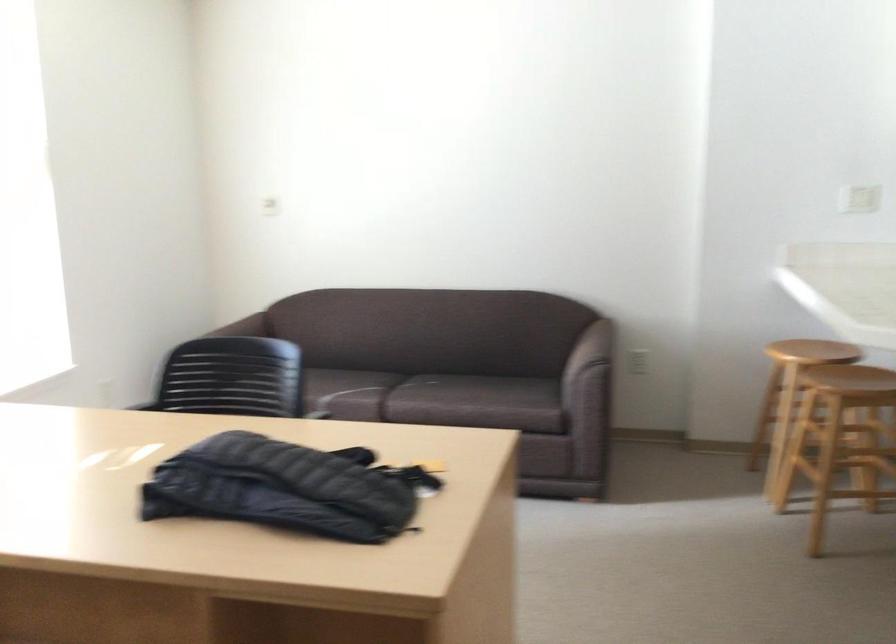
Image resolution: width=896 pixels, height=644 pixels. What do you see at coordinates (590, 348) in the screenshot? I see `the brown sofa armrest` at bounding box center [590, 348].